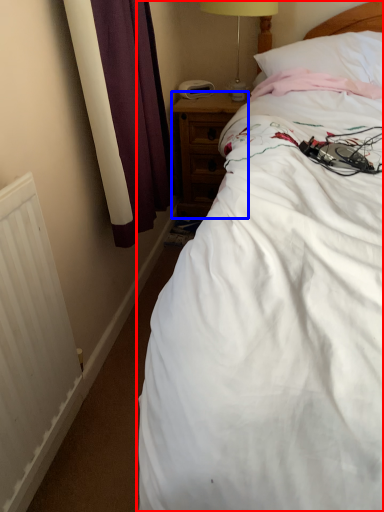
Question: Among these objects, which one is nearest to the camera, bed (highlighted by a red box) or nightstand (highlighted by a blue box)?

Choices:
 (A) bed
 (B) nightstand

Answer: (A)